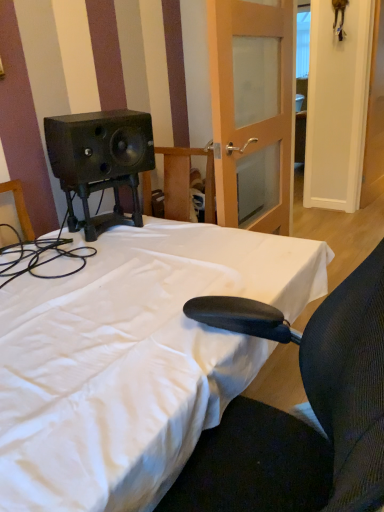
Question: Do you think white wooden door at upper right, which is counted as the first door, starting from the right, is within wooden frosted glass door at center, the 2th door in the right-to-left sequence, or outside of it?

Choices:
 (A) inside
 (B) outside

Answer: (B)

Question: Considering their positions, is white wooden door at upper right, which is counted as the first door, starting from the right, located in front of or behind wooden frosted glass door at center, which is the first door in left-to-right order?

Choices:
 (A) front
 (B) behind

Answer: (B)

Question: Based on their relative distances, which object is nearer to the white fabric bed at center?

Choices:
 (A) white wooden door at upper right, which is counted as the first door, starting from the right
 (B) wooden frosted glass door at center, the 2th door in the right-to-left sequence

Answer: (B)

Question: Which object is positioned farthest from the wooden frosted glass door at center, which is the first door in left-to-right order?

Choices:
 (A) white wooden door at upper right, which appears as the second door when viewed from the left
 (B) white fabric bed at center

Answer: (A)